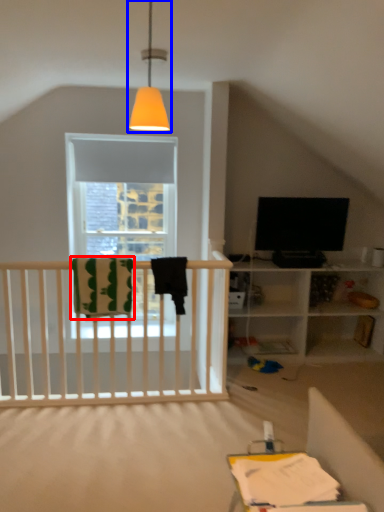
Question: Which point is closer to the camera, blanket (highlighted by a red box) or lamp (highlighted by a blue box)?

Choices:
 (A) blanket
 (B) lamp

Answer: (B)